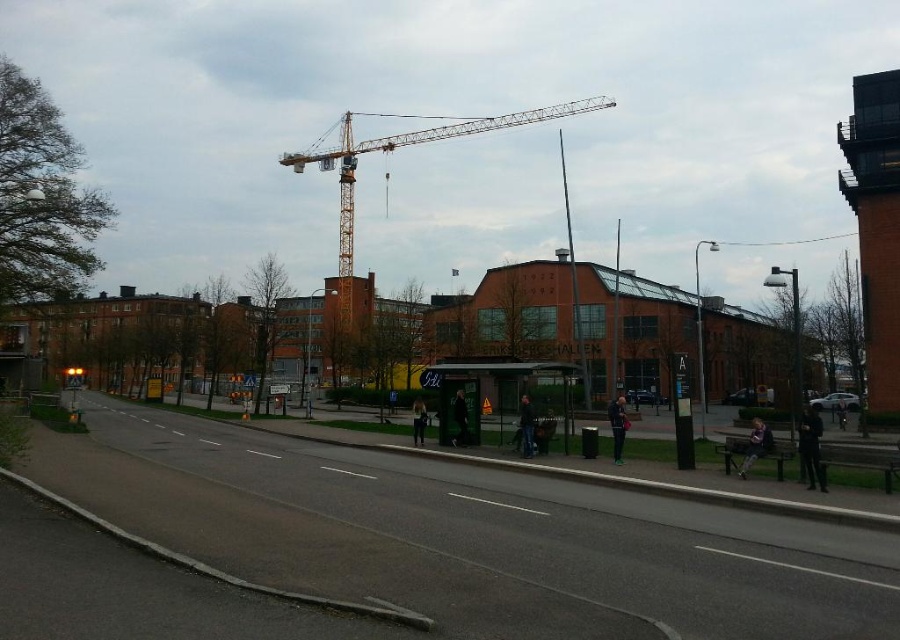
You are a delivery person carrying a large box that is 1.2 meters wide. You need to pass through the area between the transparent plastic bus stop at center and the dark blue jeans at center. Is there enough space for your box to fit through?

The transparent plastic bus stop at center is wider than the dark blue jeans at center. Since the box is 1.2 meters wide, the space between them may be sufficient if the distance between the edges allows it. However, without exact measurements of the gap, it is uncertain. The description only states the bus stop is wider, but not the exact dimensions or spacing between them. Therefore, it is unclear if the 1.2m box will fit through the space between them.

Consider the image. You are a delivery person trying to place a package on the transparent plastic bus stop at center. However, you notice dark blue jeans at center nearby. Can you place the package there without the jeans blocking access?

The transparent plastic bus stop at center is located below dark blue jeans at center, so the jeans are above the bus stop. This means the jeans are not blocking access to the bus stop, so you can place the package there.